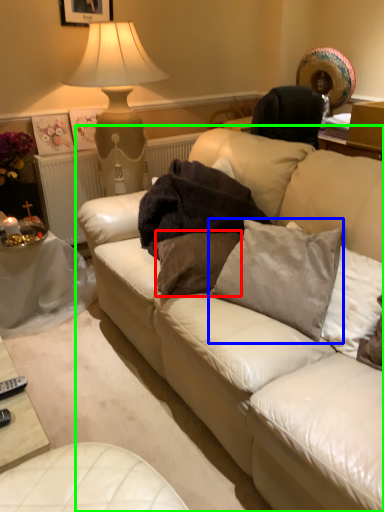
Question: Estimate the real-world distances between objects in this image. Which object is closer to pillow (highlighted by a red box), pillow (highlighted by a blue box) or studio couch (highlighted by a green box)?

Choices:
 (A) pillow
 (B) studio couch

Answer: (A)